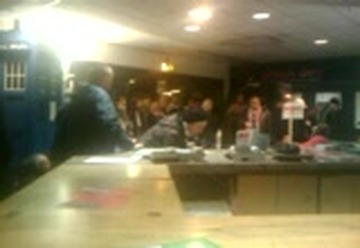
Locate an element on the screen. The height and width of the screenshot is (248, 360). side wall is located at coordinates (184, 64).